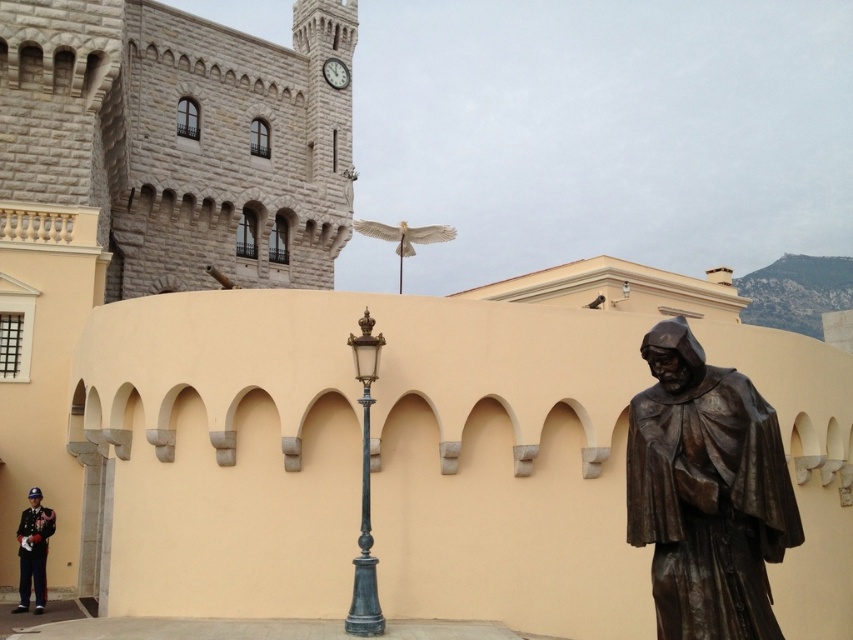
Which of these two, polished brass streetlamp at center or white stone clock at upper center, stands taller?

polished brass streetlamp at center

Can you confirm if polished brass streetlamp at center is smaller than white stone clock at upper center?

Actually, polished brass streetlamp at center might be larger than white stone clock at upper center.

The width and height of the screenshot is (853, 640). Describe the element at coordinates (364, 490) in the screenshot. I see `polished brass streetlamp at center` at that location.

Locate an element on the screen. polished brass streetlamp at center is located at coordinates (364, 490).

Can you confirm if bronze statue at right is taller than shiny black uniform at lower left?

Incorrect, bronze statue at right's height is not larger of shiny black uniform at lower left's.

Does bronze statue at right lie in front of shiny black uniform at lower left?

Yes, bronze statue at right is in front of shiny black uniform at lower left.

Does point (666, 412) come in front of point (16, 608)?

Yes, it is.

The width and height of the screenshot is (853, 640). In order to click on bronze statue at right in this screenshot , I will do `click(706, 492)`.

Is bronze statue at right shorter than white stone clock at upper center?

In fact, bronze statue at right may be taller than white stone clock at upper center.

Who is more distant from viewer, (712, 406) or (340, 68)?

The point (340, 68) is more distant.

Locate an element on the screen. The width and height of the screenshot is (853, 640). bronze statue at right is located at coordinates (706, 492).